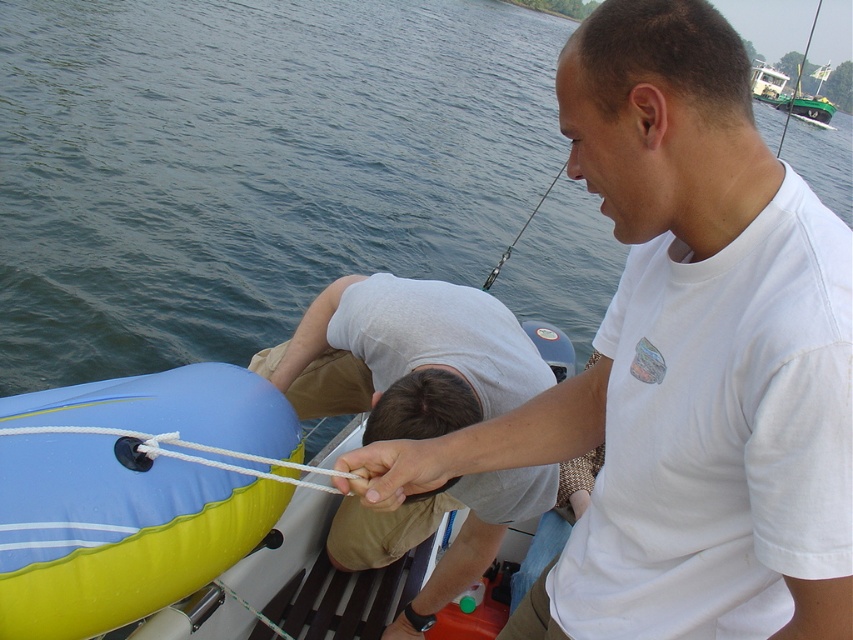
You are a sailor on a boat and need to secure the gray cotton shirt at center to the white rope at lower left. Based on their positions, can you directly attach the shirt to the rope without moving either?

The gray cotton shirt at center is located below the white rope at lower left, so you can directly attach the shirt to the rope without needing to move either since they are already in a vertical alignment.

You are a photographer trying to capture a photo of the blue rubber boat at lower left and the gray cotton shirt at center. Since you want both subjects to be clearly visible in the frame, which object should you adjust your camera angle to focus on first, considering their heights?

The blue rubber boat at lower left has a greater height compared to the gray cotton shirt at center, so you should focus on the blue rubber boat at lower left first to ensure it fits in the frame.

You are a passenger on the blue rubber boat at lower left and need to grab the gray cotton shirt at center to balance yourself. Can you reach it without moving from your current position?

The blue rubber boat at lower left is to the right of the gray cotton shirt at center, so you can reach the gray cotton shirt at center from your position on the boat.